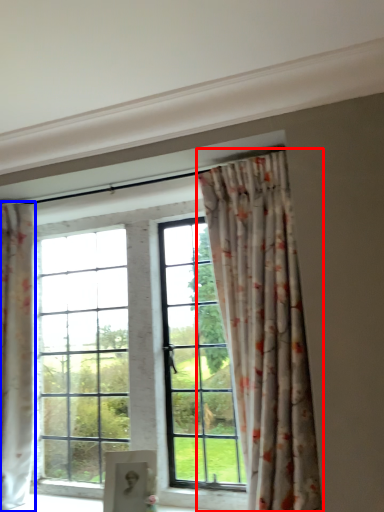
Question: Among these objects, which one is farthest to the camera, curtain (highlighted by a red box) or curtain (highlighted by a blue box)?

Choices:
 (A) curtain
 (B) curtain

Answer: (B)